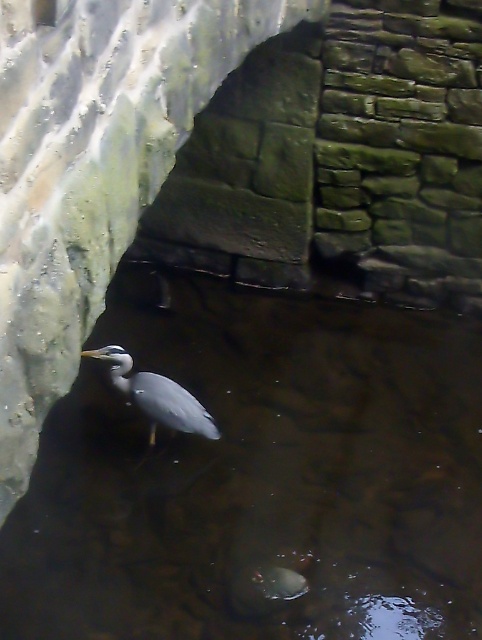
You are a visitor at the zoo and want to take a photo of the gray matte bird at center. However, you notice the clear water at center might be in the way. Can you see the bird clearly through the water?

The clear water at center is in front of the gray matte bird at center, so yes, you can see the bird clearly through the water as it is positioned in front of the bird.